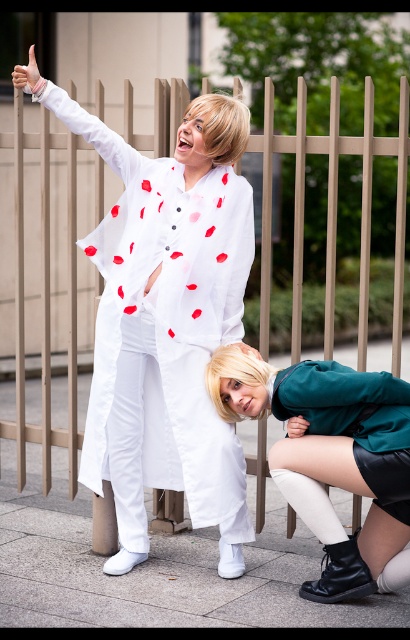
Does point (405, 204) come in front of point (350, 444)?

No, (405, 204) is behind (350, 444).

Can you confirm if metallic gold fence at upper center is taller than teal-green leather skirt at lower right?

Incorrect, metallic gold fence at upper center's height is not larger of teal-green leather skirt at lower right's.

Who is more forward, (398, 266) or (391, 481)?

Point (391, 481) is more forward.

The height and width of the screenshot is (640, 410). I want to click on metallic gold fence at upper center, so click(x=332, y=220).